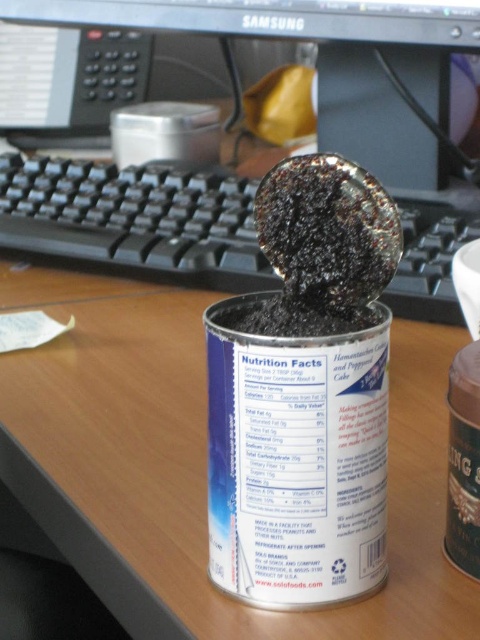
You are organizing a desk and need to place a new item on the desk. The desk has a wooden surface and currently has a can of food product and a spoon in it. There is also a point marked at coordinates [133,220]. What object is located at that point?

The point at coordinates [133,220] marks the location of the black plastic keyboard at center.

You are organizing a desk and need to place a new keyboard that requires 18 inches of space between the metallic silver can at center and the matte black monitor at upper center. Is there enough space between them?

The metallic silver can at center is 20.93 inches from the matte black monitor at upper center, which is more than the required 18 inches. Therefore, there is enough space between them.